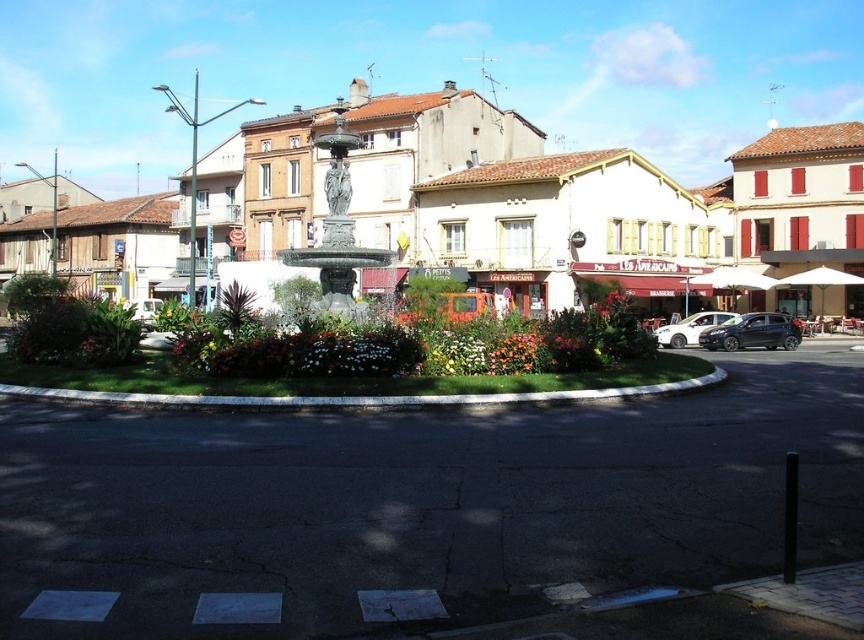
Between polished stone fountain at center and satin silver sedan at right, which one is positioned lower?

Positioned lower is satin silver sedan at right.

Does polished stone fountain at center have a smaller size compared to satin silver sedan at right?

No.

At what (x,y) coordinates should I click in order to perform the action: click on polished stone fountain at center. Please return your answer as a coordinate pair (x, y). This screenshot has width=864, height=640. Looking at the image, I should click on (605, 212).

Between black matte hatchback at right and floral bouquet at center, which one has less height?

Standing shorter between the two is floral bouquet at center.

What do you see at coordinates (753, 332) in the screenshot? The image size is (864, 640). I see `black matte hatchback at right` at bounding box center [753, 332].

Is point (753, 340) behind point (528, 336)?

Yes, point (753, 340) is behind point (528, 336).

Where is `black matte hatchback at right`? The width and height of the screenshot is (864, 640). black matte hatchback at right is located at coordinates (753, 332).

Who is more distant from viewer, (816, 289) or (356, 266)?

The point (816, 289) is more distant.

In the scene shown: Can you confirm if polished stone fountain at center is wider than green marble fountain at center?

Correct, the width of polished stone fountain at center exceeds that of green marble fountain at center.

Find the location of `polished stone fountain at center`. polished stone fountain at center is located at coordinates (605, 212).